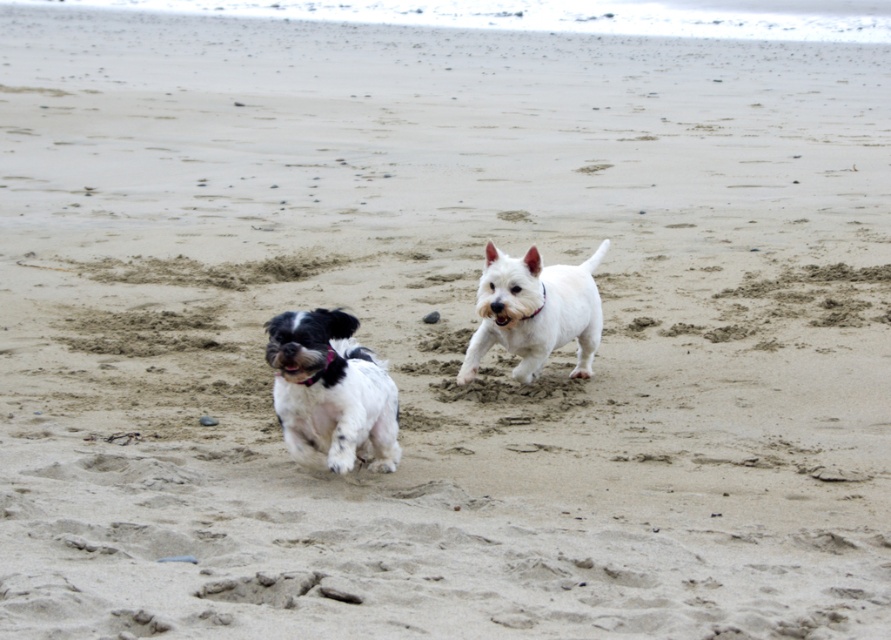
You are a photographer trying to capture both the black and white fur dog at left and the white smooth dog at center in a single shot. Based on their positions, which dog would appear lower in the photo?

The black and white fur dog at left appears lower in the photo because it is located below the white smooth dog at center.

You are standing on the beach and want to place a 3 meter long bench between the two dogs so that it doesn t block your view of the ocean. The bench must be placed exactly at point [334,360]. Can you do this?

The point [334,360] is 5.66 meters away from you. Since the bench is 3 meters long, placing it there would leave enough space between you and the bench to still see the ocean. Yes, you can place the bench there.